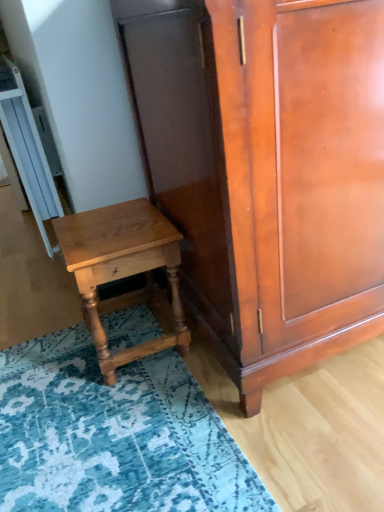
Where is `empty space that is ontop of blue textured rug at lower left (from a real-world perspective)`? empty space that is ontop of blue textured rug at lower left (from a real-world perspective) is located at coordinates pyautogui.click(x=173, y=411).